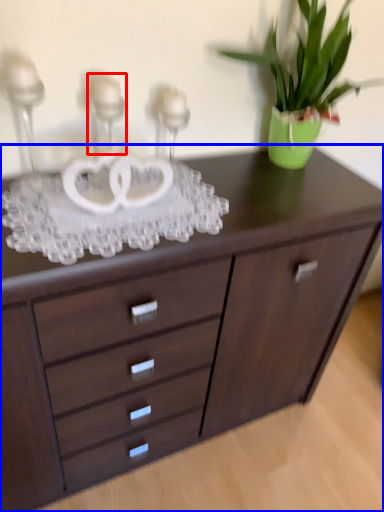
Question: Among these objects, which one is nearest to the camera, candle holder (highlighted by a red box) or chest of drawers (highlighted by a blue box)?

Choices:
 (A) candle holder
 (B) chest of drawers

Answer: (A)